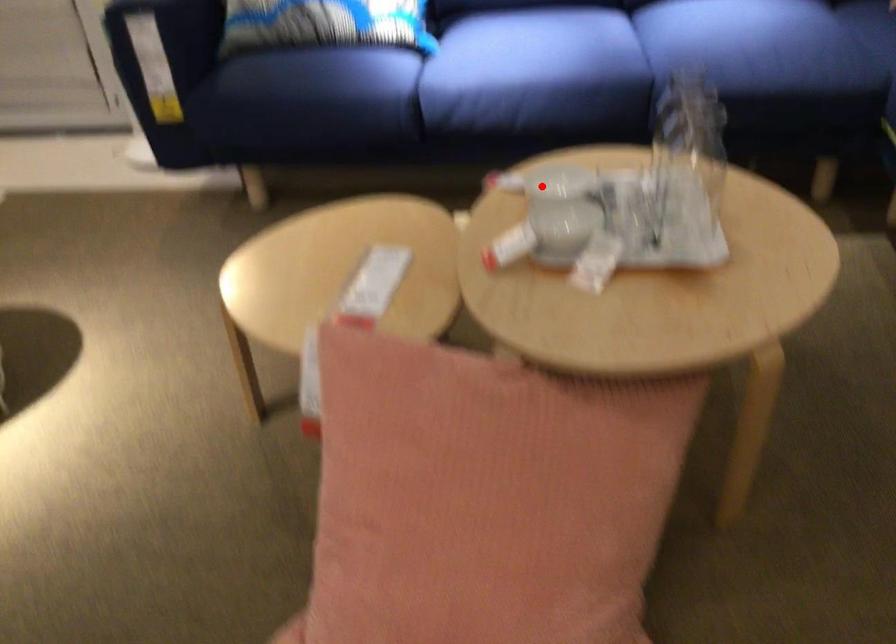
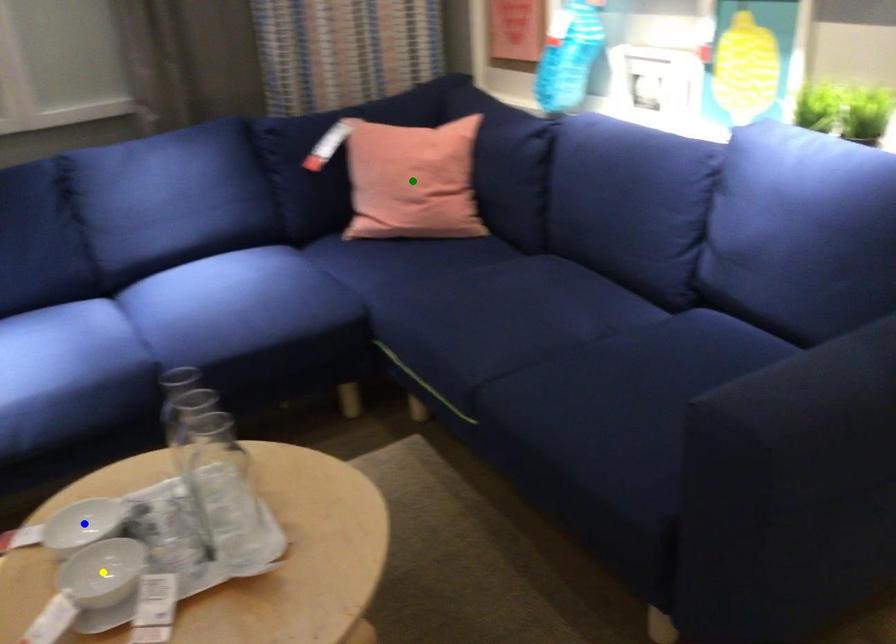
Question: I am providing you with two images of the same scene from different viewpoints. A red point is marked on the first image. You are given multiple points on the second image. Which mark in image 2 goes with the point in image 1?

Choices:
 (A) green point
 (B) blue point
 (C) yellow point

Answer: (B)